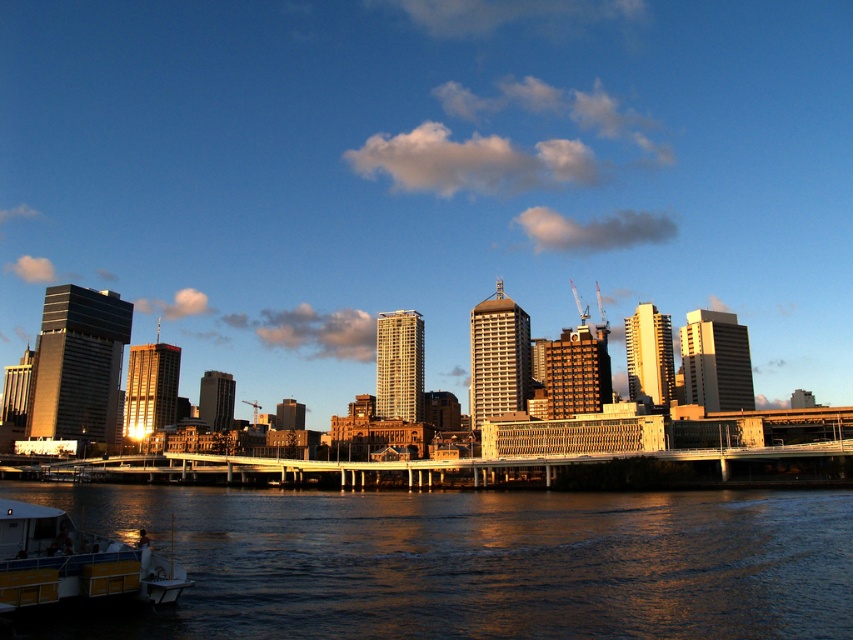
You are a photographer planning to capture the reflection of the city lights on the water. You notice the dark reflective water at lower left and the yellow plastic boat at lower left. Which object would provide a larger surface for capturing reflections?

The dark reflective water at lower left is bigger than the yellow plastic boat at lower left, so it would provide a larger surface for capturing reflections.

You are standing on a pier and looking at the dark reflective water at lower left and the yellow plastic boat at lower left. Which object is taller from your perspective?

The dark reflective water at lower left is taller than the yellow plastic boat at lower left according to the description.